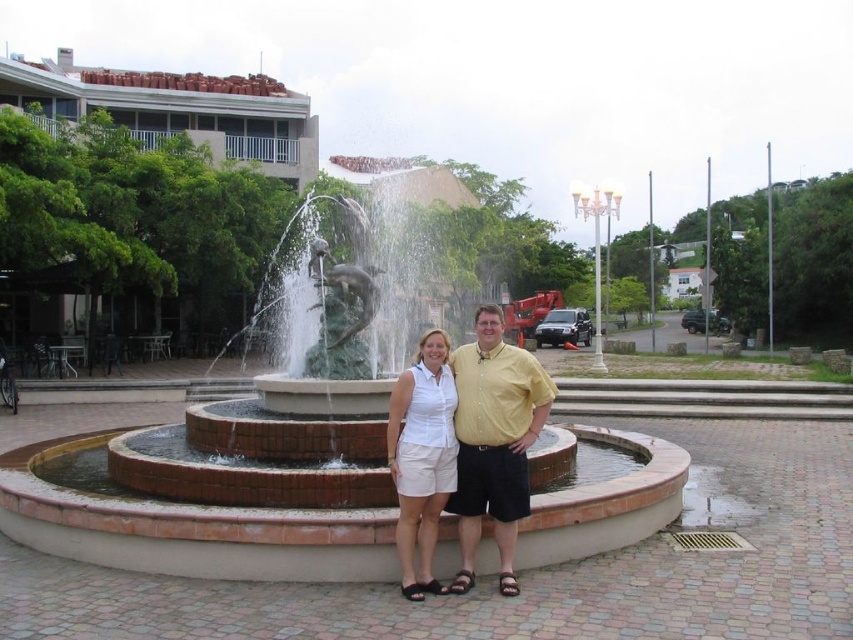
From the picture: Can you confirm if yellow cotton shirt at center is positioned below white cotton shorts at center?

Actually, yellow cotton shirt at center is above white cotton shorts at center.

Is yellow cotton shirt at center above white cotton shorts at center?

Yes, yellow cotton shirt at center is above white cotton shorts at center.

What do you see at coordinates (494, 440) in the screenshot? The image size is (853, 640). I see `yellow cotton shirt at center` at bounding box center [494, 440].

The width and height of the screenshot is (853, 640). Find the location of `yellow cotton shirt at center`. yellow cotton shirt at center is located at coordinates (494, 440).

Does point (351, 576) come in front of point (427, 560)?

No, (351, 576) is behind (427, 560).

Is point (297, 531) farther from viewer compared to point (425, 474)?

No, it is not.

Find the location of a particular element. This screenshot has width=853, height=640. brick fountain at center is located at coordinates (218, 499).

Does brick fountain at center have a smaller size compared to yellow cotton shirt at center?

Actually, brick fountain at center might be larger than yellow cotton shirt at center.

Is brick fountain at center above yellow cotton shirt at center?

No.

At what (x,y) coordinates should I click in order to perform the action: click on brick fountain at center. Please return your answer as a coordinate pair (x, y). The width and height of the screenshot is (853, 640). Looking at the image, I should click on (218, 499).